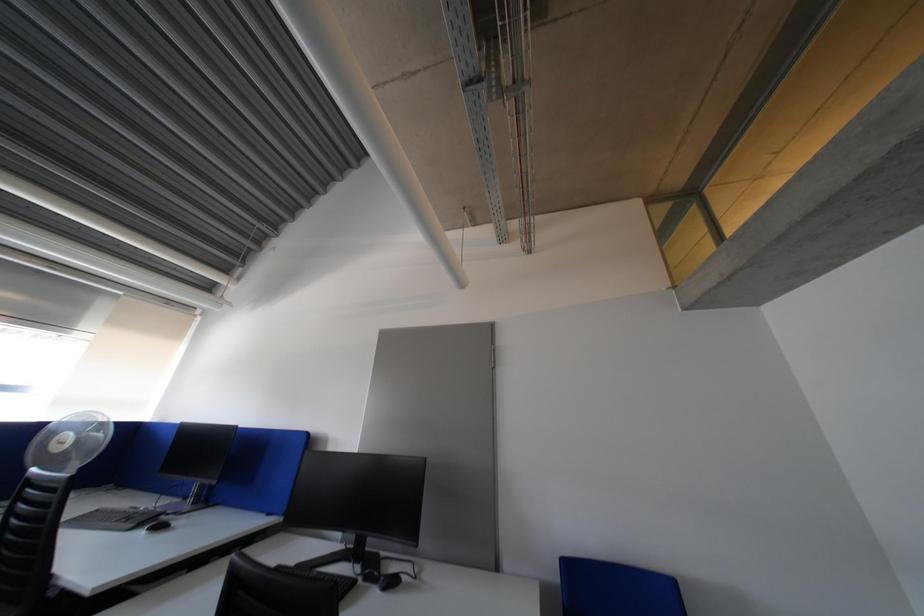
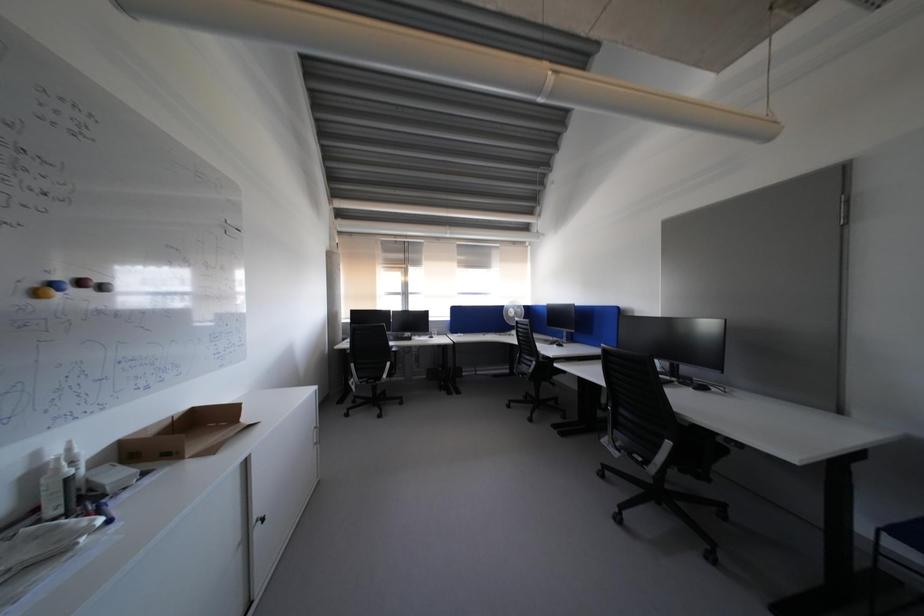
Question: Based on the continuous images, in which direction is the camera rotating? Reply with the corresponding letter.

Choices:
 (A) Left
 (B) Right
 (C) Up
 (D) Down

Answer: (A)